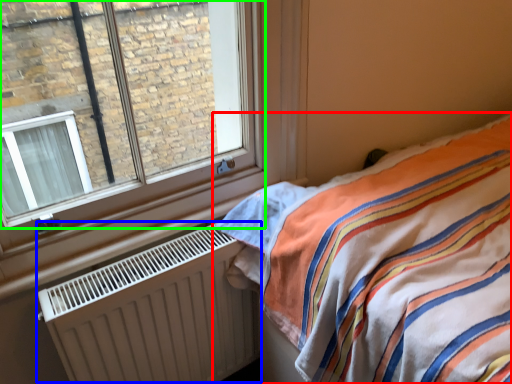
Question: Estimate the real-world distances between objects in this image. Which object is farther from bed (highlighted by a red box), radiator (highlighted by a blue box) or window (highlighted by a green box)?

Choices:
 (A) radiator
 (B) window

Answer: (B)